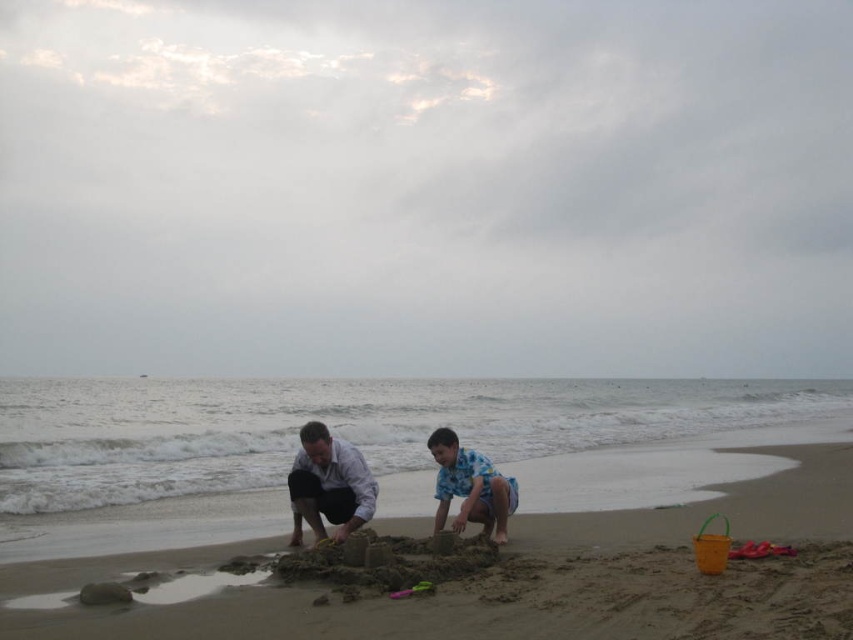
Question: Which object is closer to the camera taking this photo?

Choices:
 (A) brown sandcastle at center
 (B) light blue shirt at center

Answer: (A)

Question: Among these points, which one is nearest to the camera?

Choices:
 (A) (485, 464)
 (B) (234, 611)
 (C) (299, 509)

Answer: (B)

Question: Which point appears closest to the camera in this image?

Choices:
 (A) (439, 484)
 (B) (13, 627)
 (C) (370, 508)

Answer: (B)

Question: Does light blue shirt at center lie behind blue printed shirt at center?

Choices:
 (A) yes
 (B) no

Answer: (A)

Question: Does brown sandcastle at center have a lesser width compared to blue printed shirt at center?

Choices:
 (A) yes
 (B) no

Answer: (B)

Question: In this image, where is brown sandcastle at center located relative to light blue shirt at center?

Choices:
 (A) below
 (B) above

Answer: (A)